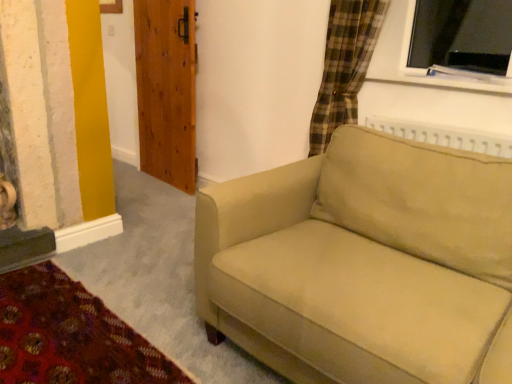
Question: Is point (157, 8) closer or farther from the camera than point (426, 259)?

Choices:
 (A) closer
 (B) farther

Answer: (B)

Question: Is wooden door at upper left wider or thinner than beige fabric couch at center?

Choices:
 (A) wide
 (B) thin

Answer: (B)

Question: Is wooden door at upper left taller or shorter than beige fabric couch at center?

Choices:
 (A) tall
 (B) short

Answer: (A)

Question: Would you say beige fabric couch at center is inside or outside wooden door at upper left?

Choices:
 (A) inside
 (B) outside

Answer: (B)

Question: From the image's perspective, is beige fabric couch at center positioned above or below wooden door at upper left?

Choices:
 (A) above
 (B) below

Answer: (B)

Question: In the image, is beige fabric couch at center positioned in front of or behind wooden door at upper left?

Choices:
 (A) front
 (B) behind

Answer: (A)

Question: Does point (322, 367) appear closer or farther from the camera than point (170, 109)?

Choices:
 (A) farther
 (B) closer

Answer: (B)